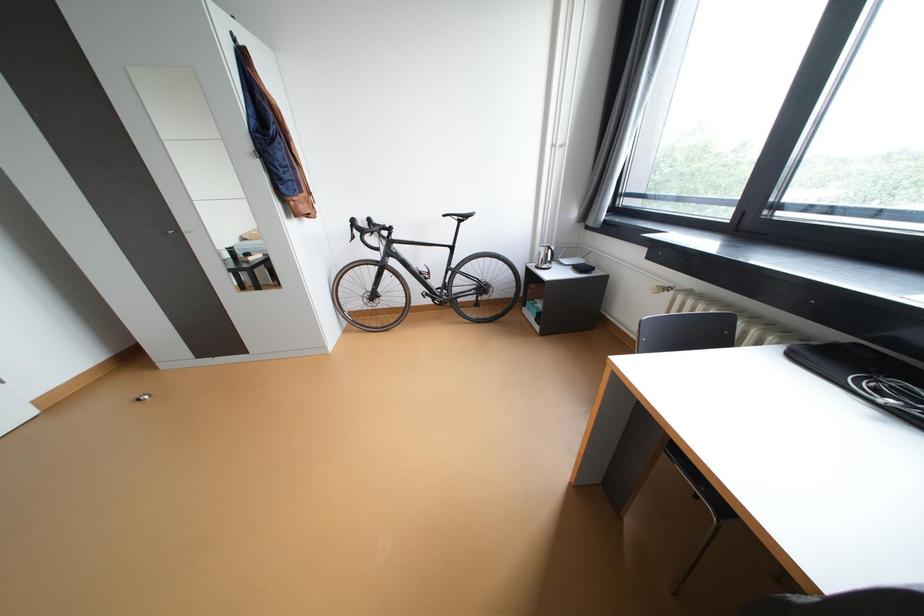
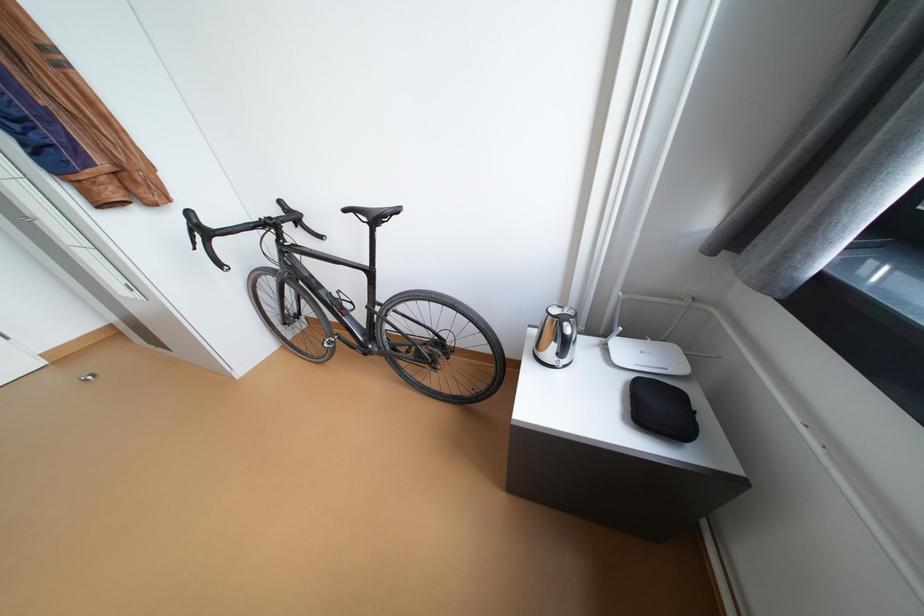
What movement of the cameraman would produce the second image?

The movement direction of the cameraman is right, forward.